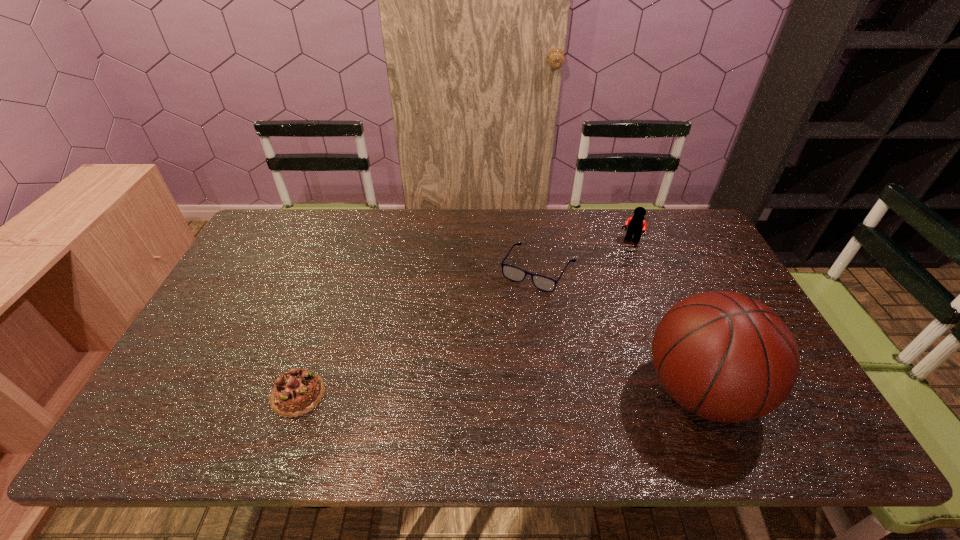
Find the location of a particular element. free region at the right edge is located at coordinates (671, 266).

Locate an element on the screen. This screenshot has height=540, width=960. vacant region at the far left corner of the desktop is located at coordinates (289, 220).

Where is `free space at the far right corner of the desktop`? free space at the far right corner of the desktop is located at coordinates (668, 230).

Image resolution: width=960 pixels, height=540 pixels. I want to click on free space between the tallest object and the leftmost object, so click(x=498, y=393).

Locate an element on the screen. The image size is (960, 540). free space between the third object from right to left and the leftmost object is located at coordinates (419, 332).

Image resolution: width=960 pixels, height=540 pixels. What are the coordinates of `empty location between the chocolate cake and the tallest object` in the screenshot? It's located at (498, 393).

Where is `free space between the second tallest object and the chocolate cake`? Image resolution: width=960 pixels, height=540 pixels. free space between the second tallest object and the chocolate cake is located at coordinates (464, 318).

Where is `free space between the second tallest object and the spectacles`? This screenshot has width=960, height=540. free space between the second tallest object and the spectacles is located at coordinates [585, 255].

The height and width of the screenshot is (540, 960). What are the coordinates of `vacant space that is in between the third shortest object and the spectacles` in the screenshot? It's located at (585, 255).

Locate an element on the screen. This screenshot has width=960, height=540. empty location between the basketball and the spectacles is located at coordinates (619, 330).